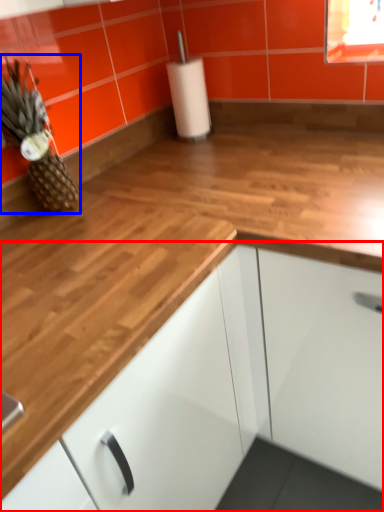
Question: Among these objects, which one is farthest to the camera, cabinetry (highlighted by a red box) or pineapple (highlighted by a blue box)?

Choices:
 (A) cabinetry
 (B) pineapple

Answer: (B)